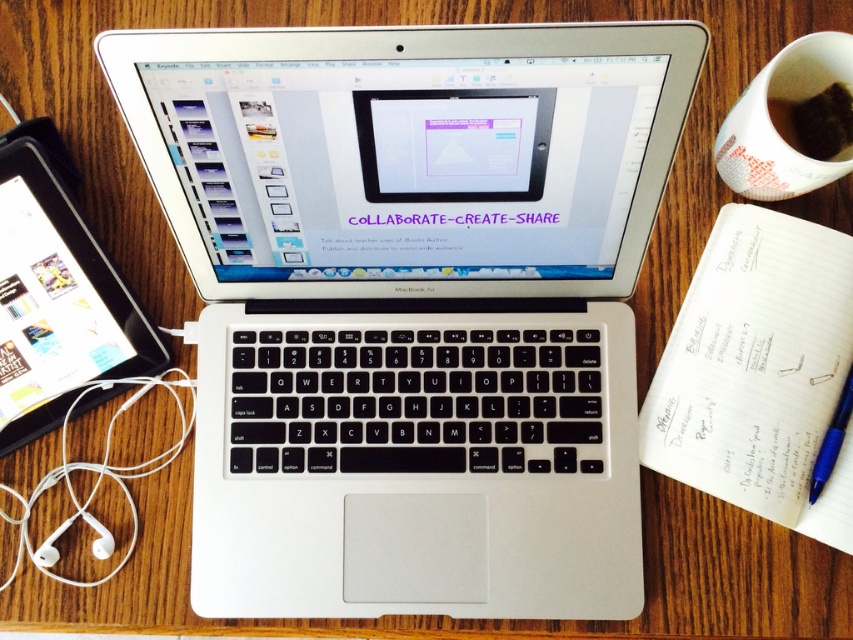
You are organizing your desk and need to place the black plastic tablet at left and the blue metallic pen at lower right. According to the image, which object is positioned to the left of the other?

The black plastic tablet at left is positioned to the left of the blue metallic pen at lower right.

You are organizing the desk items and want to place the silver metallic laptop at center and the black plastic tablet at left in a straight line from left to right. According to their current positions, which device should come first in the line?

The black plastic tablet at left should come first in the line since the silver metallic laptop at center is positioned on the right side of it.

What are the coordinates of the black plastic tablet at left?

The coordinates of the black plastic tablet at left are at point (57,301).